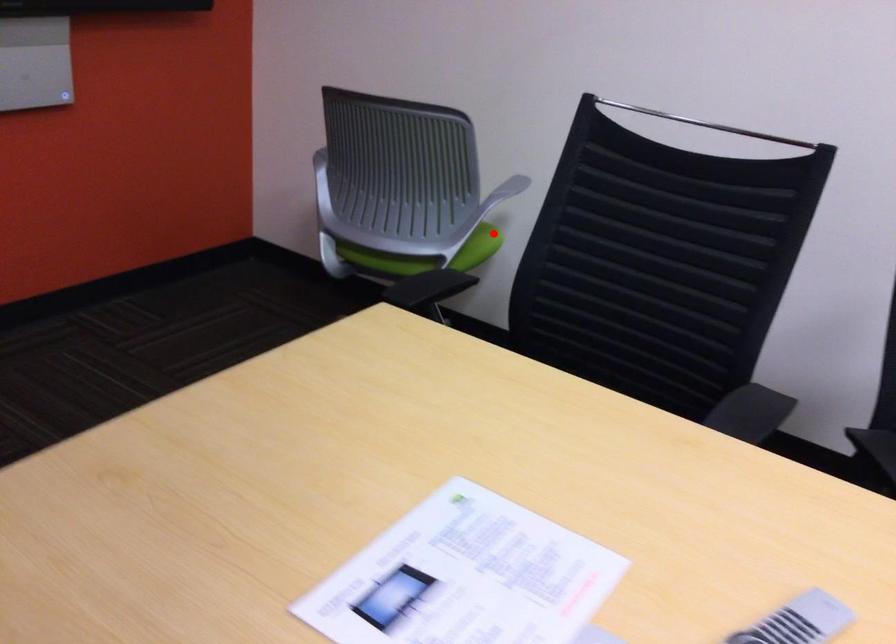
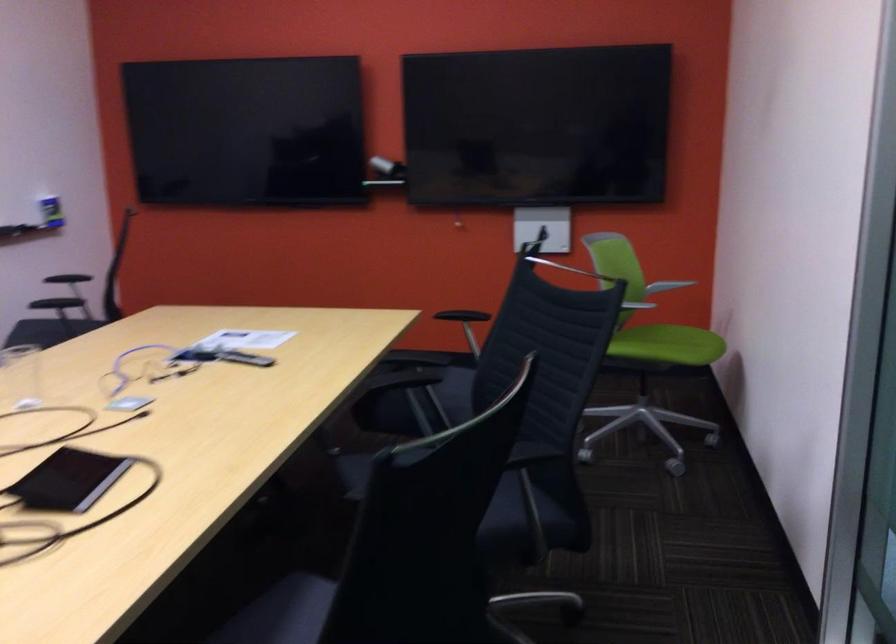
Question: I am providing you with two images of the same scene from different viewpoints. A red point is shown in image1. For the corresponding object point in image2, is it positioned nearer or farther from the camera?

Choices:
 (A) Nearer
 (B) Farther

Answer: (B)